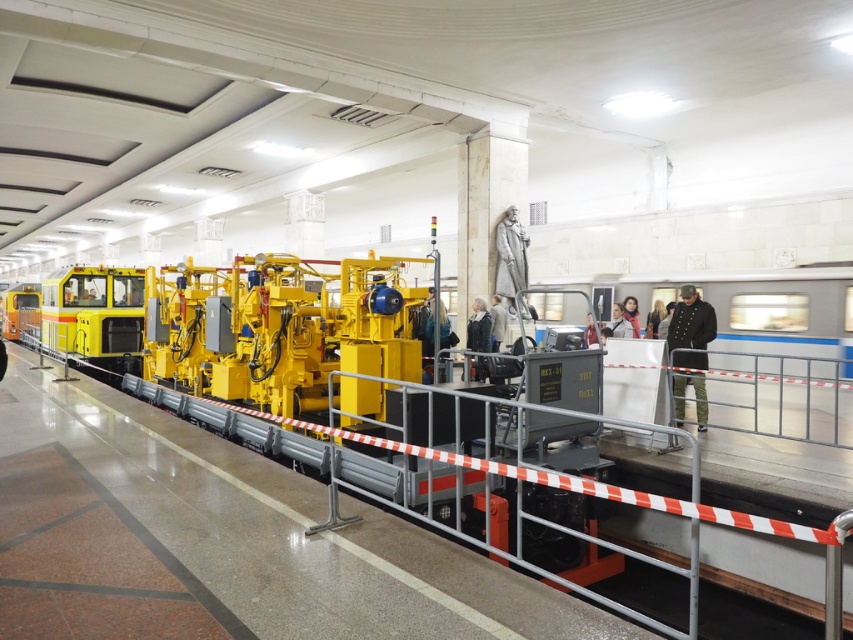
You are a commuter waiting at the subway station platform. You notice two items of clothing nearby. Which one is larger in size between the dark green uniform at right and the matte black scarf at center?

The dark green uniform at right is bigger than the matte black scarf at center.

You are a passenger on the subway platform and see two workers wearing dark green uniform at right and dark blue uniform at center. Which worker is standing to the left of the other?

The dark green uniform at right is positioned on the left side of dark blue uniform at center, so the dark green uniform at right is to the left of the dark blue uniform at center.

You are a subway worker who needs to store both the dark gray fabric coat at center and the matte black scarf at center in a small locker. Based on the scene, which item should you store first to ensure both fit?

The dark gray fabric coat at center occupies less space than the matte black scarf at center, so you should store the matte black scarf at center first to ensure both fit in the locker.